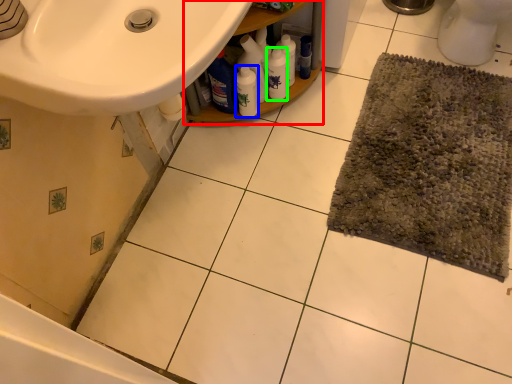
Question: Which object is positioned farthest from balustrade (highlighted by a red box)? Select from bottle (highlighted by a blue box) and cleaning product (highlighted by a green box).

Choices:
 (A) bottle
 (B) cleaning product

Answer: (A)